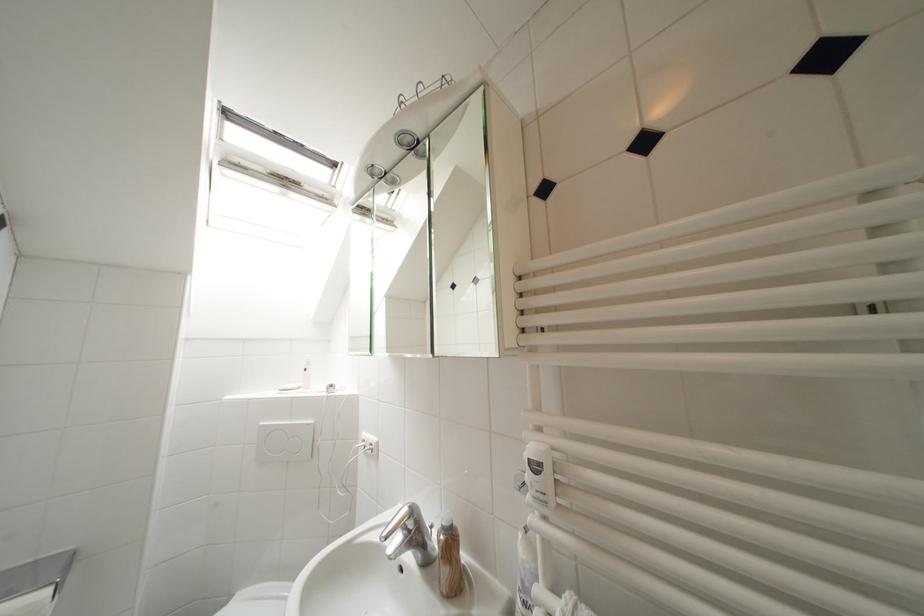
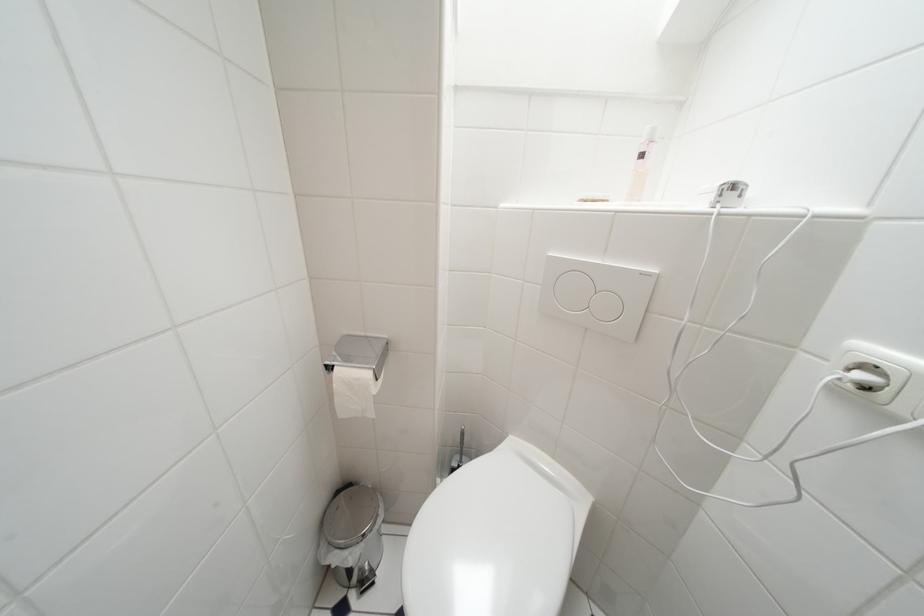
How did the camera likely rotate?

The camera rotated toward left-down.